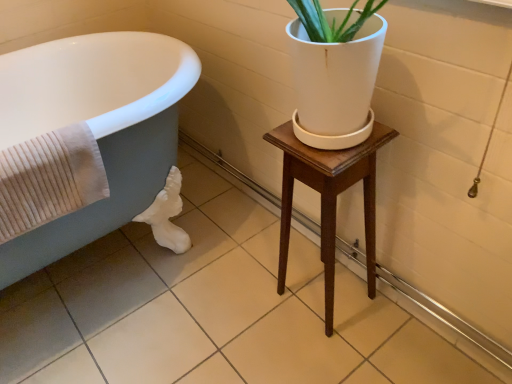
Describe the element at coordinates (96, 139) in the screenshot. Image resolution: width=512 pixels, height=384 pixels. I see `matte gray bathtub at left` at that location.

In order to click on beige ribbed towel at left in this screenshot , I will do point(49,179).

Image resolution: width=512 pixels, height=384 pixels. In order to click on wooden stool at center in this screenshot , I will do `click(329, 197)`.

The width and height of the screenshot is (512, 384). Describe the element at coordinates (329, 197) in the screenshot. I see `wooden stool at center` at that location.

Locate an element on the screen. The image size is (512, 384). matte gray bathtub at left is located at coordinates (96, 139).

Considering the relative positions of matte gray bathtub at left and beige ribbed towel at left in the image provided, is matte gray bathtub at left to the left of beige ribbed towel at left from the viewer's perspective?

Indeed, matte gray bathtub at left is positioned on the left side of beige ribbed towel at left.

Is matte gray bathtub at left far from beige ribbed towel at left?

They are positioned close to each other.

Is matte gray bathtub at left aimed at beige ribbed towel at left?

Yes, matte gray bathtub at left is facing beige ribbed towel at left.

Considering the relative sizes of matte gray bathtub at left and beige ribbed towel at left in the image provided, is matte gray bathtub at left shorter than beige ribbed towel at left?

Answer: No, matte gray bathtub at left is not shorter than beige ribbed towel at left.

Which of these two, wooden stool at center or matte gray bathtub at left, stands taller?

matte gray bathtub at left.

Can you confirm if wooden stool at center is smaller than matte gray bathtub at left?

Yes, wooden stool at center is smaller than matte gray bathtub at left.

Where is `bathtub above the wooden stool at center (from the image's perspective)`? Image resolution: width=512 pixels, height=384 pixels. bathtub above the wooden stool at center (from the image's perspective) is located at coordinates pos(96,139).

Is point (371, 211) positioned in front of point (53, 60)?

That is True.

From a real-world perspective, is wooden stool at center located beneath beige ribbed towel at left?

Yes, from a real-world perspective, wooden stool at center is under beige ribbed towel at left.

Is wooden stool at center facing away from beige ribbed towel at left?

No, wooden stool at center's orientation is not away from beige ribbed towel at left.

Considering their positions, is wooden stool at center located in front of or behind beige ribbed towel at left?

wooden stool at center is behind beige ribbed towel at left.

Considering the relative sizes of wooden stool at center and beige ribbed towel at left in the image provided, is wooden stool at center thinner than beige ribbed towel at left?

Incorrect, the width of wooden stool at center is not less than that of beige ribbed towel at left.

Between point (22, 209) and point (196, 63), which one is positioned in front?

The point (22, 209) is in front.

In the scene shown: Do you think beige ribbed towel at left is within matte gray bathtub at left, or outside of it?

beige ribbed towel at left fits inside matte gray bathtub at left.

From the image's perspective, does beige ribbed towel at left appear lower than matte gray bathtub at left?

Correct, beige ribbed towel at left appears lower than matte gray bathtub at left in the image.

Is matte gray bathtub at left wider than wooden stool at center?

Yes.

Considering the points (127, 210) and (284, 199), which point is in front, point (127, 210) or point (284, 199)?

The point (284, 199) is closer to the camera.

Measure the distance between matte gray bathtub at left and wooden stool at center.

They are 60.83 centimeters apart.

Is matte gray bathtub at left oriented towards wooden stool at center?

Yes.

Is beige ribbed towel at left inside the boundaries of wooden stool at center, or outside?

beige ribbed towel at left is spatially situated outside wooden stool at center.

From the picture: Is the surface of beige ribbed towel at left in direct contact with wooden stool at center?

No.

From a real-world perspective, which object rests below the other?

wooden stool at center is physically lower.

Considering the relative positions of beige ribbed towel at left and wooden stool at center in the image provided, is beige ribbed towel at left to the left of wooden stool at center from the viewer's perspective?

Yes, beige ribbed towel at left is to the left of wooden stool at center.

This screenshot has width=512, height=384. I want to click on bath towel behind the matte gray bathtub at left, so click(49, 179).

At what (x,y) coordinates should I click in order to perform the action: click on furniture on the right of matte gray bathtub at left. Please return your answer as a coordinate pair (x, y). The width and height of the screenshot is (512, 384). Looking at the image, I should click on (329, 197).

Considering their positions, is wooden stool at center positioned closer to matte gray bathtub at left than beige ribbed towel at left?

Based on the image, beige ribbed towel at left appears to be nearer to matte gray bathtub at left.

Considering their positions, is wooden stool at center positioned closer to beige ribbed towel at left than matte gray bathtub at left?

matte gray bathtub at left is closer to beige ribbed towel at left.

Based on their spatial positions, is matte gray bathtub at left or beige ribbed towel at left further from wooden stool at center?

Based on the image, matte gray bathtub at left appears to be further to wooden stool at center.

From the image, which object appears to be farther from wooden stool at center, beige ribbed towel at left or matte gray bathtub at left?

matte gray bathtub at left lies further to wooden stool at center than the other object.

When comparing their distances from matte gray bathtub at left, does beige ribbed towel at left or wooden stool at center seem further?

wooden stool at center lies further to matte gray bathtub at left than the other object.

From the picture: Looking at the image, which one is located closer to beige ribbed towel at left, matte gray bathtub at left or wooden stool at center?

matte gray bathtub at left is closer to beige ribbed towel at left.

Where is `bath towel between matte gray bathtub at left and wooden stool at center from left to right`? bath towel between matte gray bathtub at left and wooden stool at center from left to right is located at coordinates [x=49, y=179].